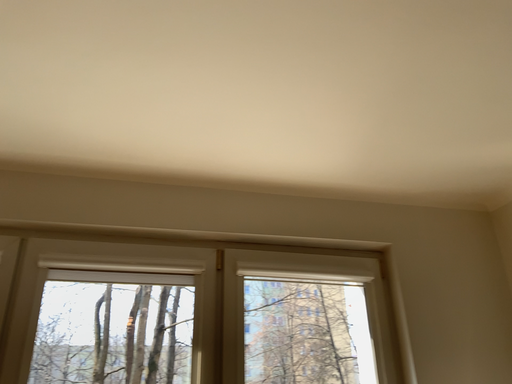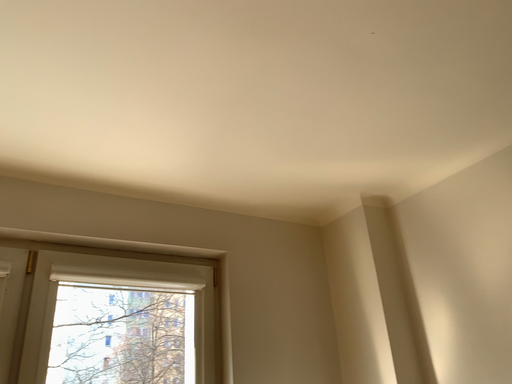
Question: Which way did the camera rotate in the video?

Choices:
 (A) rotated right
 (B) rotated left

Answer: (A)